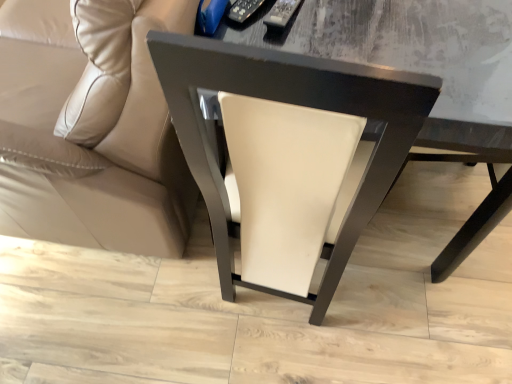
Question: Is white leather chair at center taller or shorter than beige leather couch at lower left?

Choices:
 (A) tall
 (B) short

Answer: (B)

Question: Is white leather chair at center wider or thinner than beige leather couch at lower left?

Choices:
 (A) wide
 (B) thin

Answer: (B)

Question: Is white leather chair at center inside the boundaries of beige leather couch at lower left, or outside?

Choices:
 (A) outside
 (B) inside

Answer: (A)

Question: Based on their sizes in the image, would you say beige leather couch at lower left is bigger or smaller than white leather chair at center?

Choices:
 (A) small
 (B) big

Answer: (B)

Question: In the image, is beige leather couch at lower left on the left side or the right side of white leather chair at center?

Choices:
 (A) left
 (B) right

Answer: (A)

Question: Is point [x=119, y=147] positioned closer to the camera than point [x=202, y=127]?

Choices:
 (A) farther
 (B) closer

Answer: (A)

Question: From a real-world perspective, relative to white leather chair at center, is beige leather couch at lower left vertically above or below?

Choices:
 (A) below
 (B) above

Answer: (B)